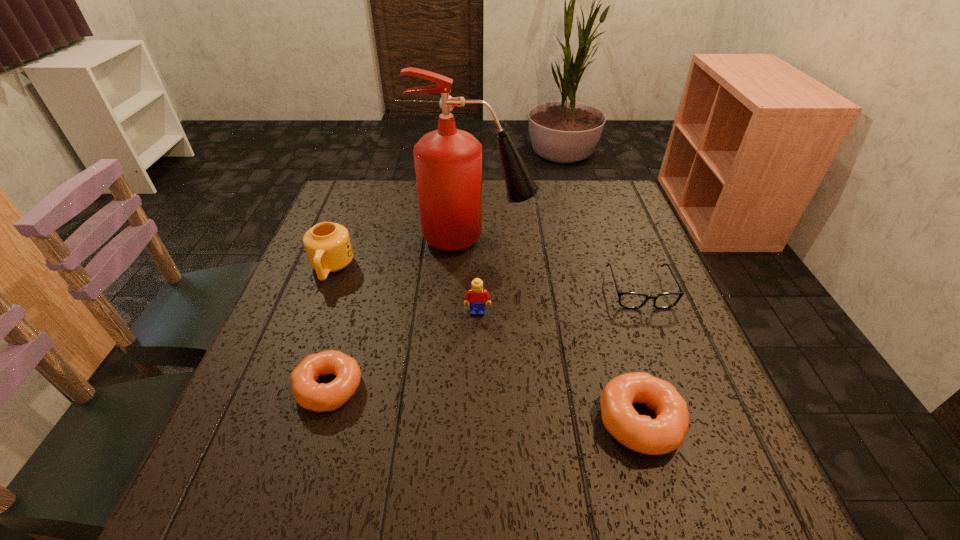
Locate an element on the screen. free space at the far edge of the desktop is located at coordinates (562, 217).

Where is `blank space at the near edge of the desktop`? The height and width of the screenshot is (540, 960). blank space at the near edge of the desktop is located at coordinates (532, 412).

What are the coordinates of `free space at the left edge` in the screenshot? It's located at (269, 393).

Locate an element on the screen. This screenshot has width=960, height=540. blank space at the right edge of the desktop is located at coordinates (636, 353).

You are a GUI agent. You are given a task and a screenshot of the screen. Output one action in this format:
    pyautogui.click(x=<x>, y=<y>)
    Task: Click on the free location at the far left corner
    This screenshot has width=960, height=540.
    Given the screenshot: What is the action you would take?
    pyautogui.click(x=372, y=223)

I want to click on vacant area between the spectacles and the taller doughnut, so click(x=640, y=355).

Identify the location of unoccupied area between the right doughnut and the mug. (486, 345).

The height and width of the screenshot is (540, 960). I want to click on free area in between the Lego and the right doughnut, so click(x=559, y=367).

Identify the location of empty space between the right doughnut and the spectacles. The height and width of the screenshot is (540, 960). (640, 355).

Locate an element on the screen. free area in between the spectacles and the right doughnut is located at coordinates (640, 355).